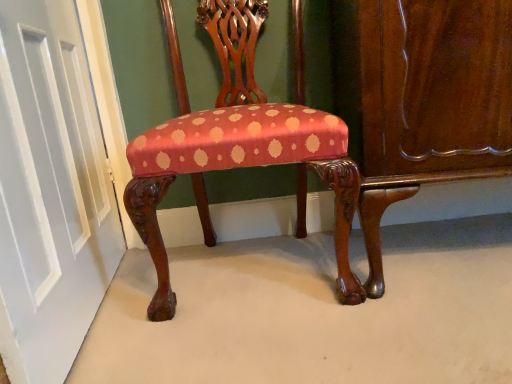
Question: Considering the relative positions of glossy wood dresser at lower right and white painted wood door at left in the image provided, is glossy wood dresser at lower right to the left of white painted wood door at left from the viewer's perspective?

Choices:
 (A) yes
 (B) no

Answer: (B)

Question: Is glossy wood dresser at lower right facing away from white painted wood door at left?

Choices:
 (A) no
 (B) yes

Answer: (A)

Question: Is glossy wood dresser at lower right not inside white painted wood door at left?

Choices:
 (A) no
 (B) yes

Answer: (B)

Question: From a real-world perspective, is glossy wood dresser at lower right physically above white painted wood door at left?

Choices:
 (A) no
 (B) yes

Answer: (A)

Question: From the image's perspective, is glossy wood dresser at lower right located beneath white painted wood door at left?

Choices:
 (A) no
 (B) yes

Answer: (A)

Question: Is glossy wood dresser at lower right beside white painted wood door at left?

Choices:
 (A) yes
 (B) no

Answer: (B)

Question: From a real-world perspective, does white painted wood door at left sit lower than glossy wood dresser at lower right?

Choices:
 (A) no
 (B) yes

Answer: (A)

Question: Considering the relative positions of white painted wood door at left and glossy wood dresser at lower right in the image provided, is white painted wood door at left to the right of glossy wood dresser at lower right from the viewer's perspective?

Choices:
 (A) no
 (B) yes

Answer: (A)

Question: Is the position of white painted wood door at left more distant than that of glossy wood dresser at lower right?

Choices:
 (A) yes
 (B) no

Answer: (B)

Question: Is white painted wood door at left smaller than glossy wood dresser at lower right?

Choices:
 (A) yes
 (B) no

Answer: (A)

Question: Is white painted wood door at left bigger than glossy wood dresser at lower right?

Choices:
 (A) yes
 (B) no

Answer: (B)

Question: Can you confirm if white painted wood door at left is shorter than glossy wood dresser at lower right?

Choices:
 (A) no
 (B) yes

Answer: (A)

Question: Is white painted wood door at left closer to the viewer compared to silky red fabric chair at center?

Choices:
 (A) yes
 (B) no

Answer: (A)